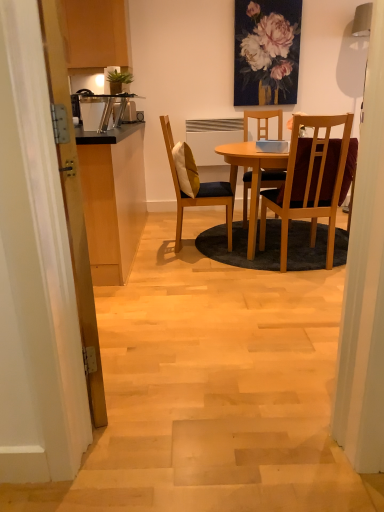
The image size is (384, 512). I want to click on free space to the right of wooden door at left, so click(x=185, y=355).